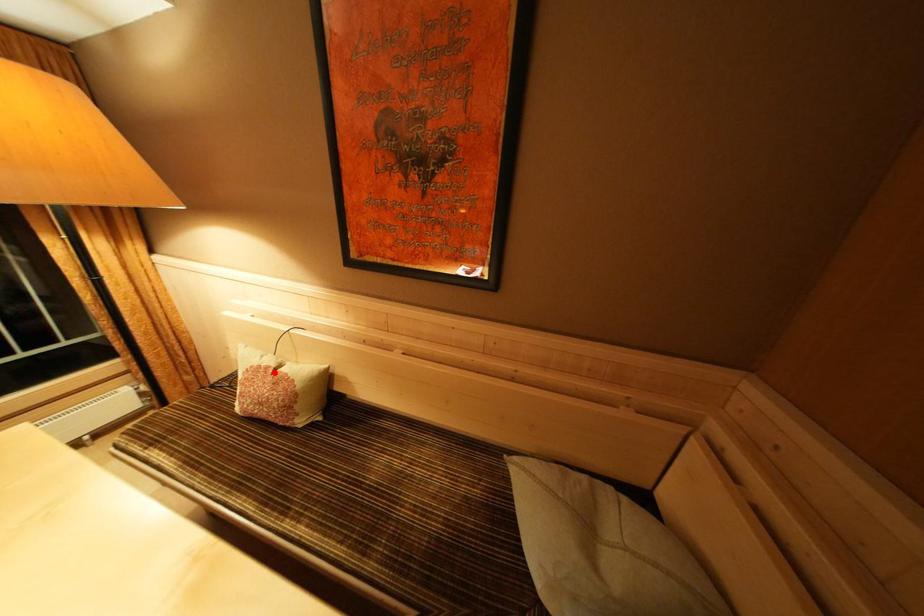
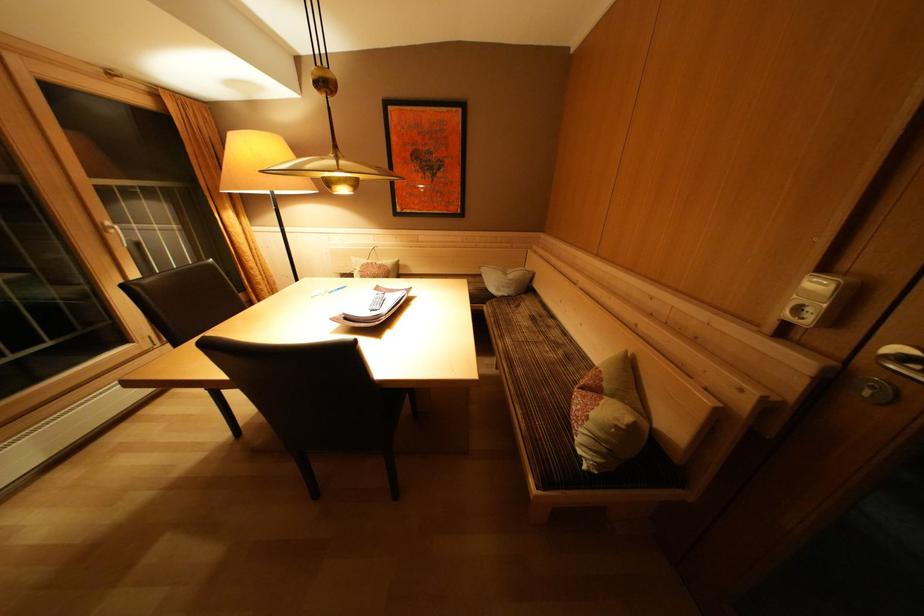
The point at the highlighted location is marked in the first image. Where is the corresponding point in the second image?

(379, 268)